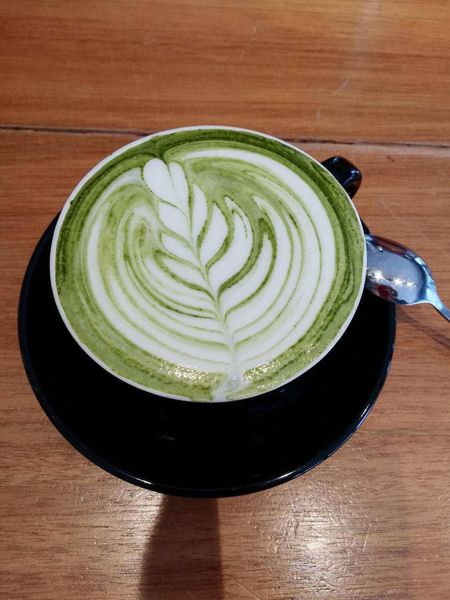
Find the location of a particular element. The width and height of the screenshot is (450, 600). empty space on saucer is located at coordinates (58, 351), (149, 436), (259, 436), (319, 393), (360, 343).